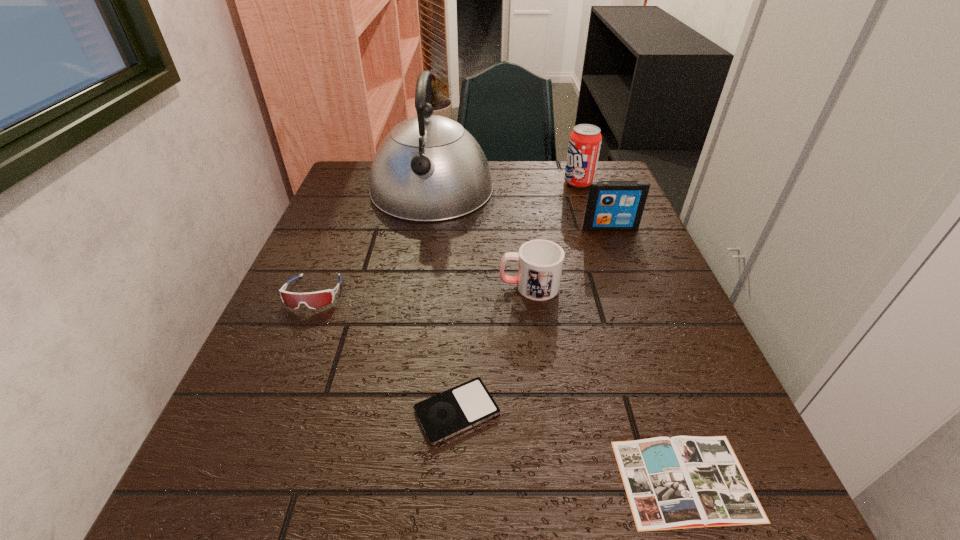
Identify the location of object located in the far right corner section of the desktop. Image resolution: width=960 pixels, height=540 pixels. tap(585, 140).

Locate an element on the screen. object present at the near right corner is located at coordinates (681, 482).

In the image, there is a desktop. Find the location of `vacant region at the left edge`. vacant region at the left edge is located at coordinates (231, 461).

Where is `free region at the right edge of the desktop`? free region at the right edge of the desktop is located at coordinates (597, 258).

In the image, there is a desktop. At what (x,y) coordinates should I click in order to perform the action: click on free space at the far right corner. Please return your answer as a coordinate pair (x, y). Image resolution: width=960 pixels, height=540 pixels. Looking at the image, I should click on (582, 195).

Locate an element on the screen. This screenshot has height=540, width=960. vacant space in between the second tallest object and the fourth object from right to left is located at coordinates (554, 234).

Locate an element on the screen. The image size is (960, 540). empty space that is in between the goggles and the fourth object from right to left is located at coordinates (421, 289).

Find the location of a particular element. This screenshot has width=960, height=540. free space between the mug and the kettle is located at coordinates (480, 238).

Locate an element on the screen. free point between the fifth tallest object and the fourth shortest object is located at coordinates (421, 289).

The height and width of the screenshot is (540, 960). Identify the location of free point between the second tallest object and the book. point(632,332).